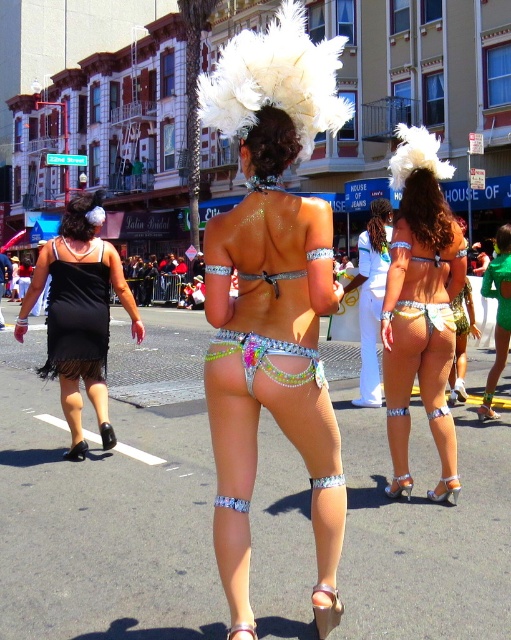
Which is in front, point (314, 596) or point (498, 413)?

Point (314, 596) is more forward.

Can you confirm if shiny metallic sandal at lower center is bigger than silver metallic sandal at lower right?

Incorrect, shiny metallic sandal at lower center is not larger than silver metallic sandal at lower right.

Is point (330, 624) in front of point (497, 419)?

Yes, it is in front of point (497, 419).

Locate an element on the screen. shiny metallic sandal at lower center is located at coordinates (326, 609).

Is the position of shiny orange leather sandal at lower center less distant than that of black patent leather sandal at lower left?

→ Yes, it is.

Which of these two, shiny orange leather sandal at lower center or black patent leather sandal at lower left, stands shorter?

With less height is black patent leather sandal at lower left.

Is point (406, 492) behind point (80, 456)?

No, (406, 492) is closer to viewer.

The image size is (511, 640). Find the location of `shiny orange leather sandal at lower center`. shiny orange leather sandal at lower center is located at coordinates point(400,486).

Describe the element at coordinates (267, 356) in the screenshot. I see `multicolored sequined bikini bottom at center` at that location.

Is multicolored sequined bikini bottom at center below silver metallic sandal at lower right?

No, multicolored sequined bikini bottom at center is not below silver metallic sandal at lower right.

Does point (243, 337) come behind point (489, 408)?

No.

This screenshot has width=511, height=640. What are the coordinates of `multicolored sequined bikini bottom at center` in the screenshot? It's located at (267, 356).